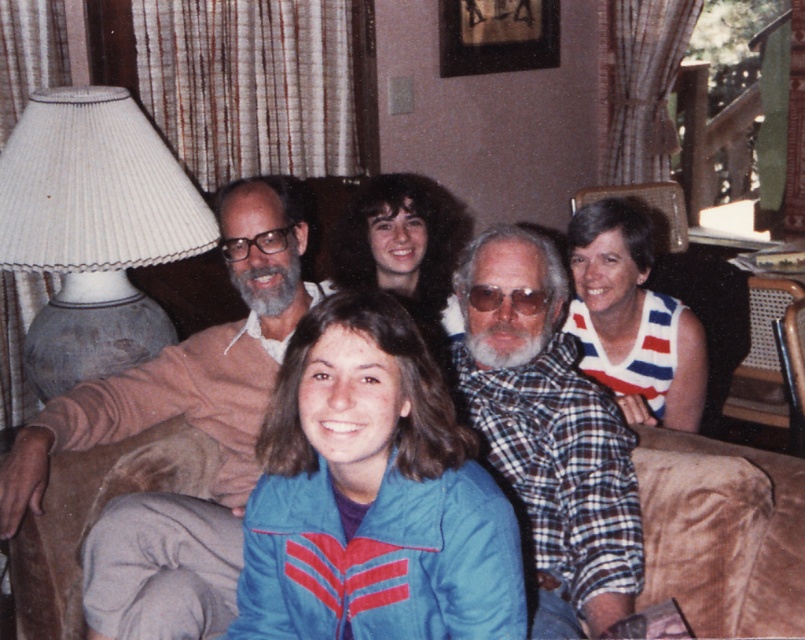
Question: Does blue nylon jacket at center have a larger size compared to matte black glasses at upper center?

Choices:
 (A) yes
 (B) no

Answer: (A)

Question: Which of the following is the farthest from the observer?

Choices:
 (A) (469, 289)
 (B) (742, 547)
 (C) (39, 499)

Answer: (C)

Question: Does light brown sweater at left come behind matte black glasses at upper center?

Choices:
 (A) yes
 (B) no

Answer: (B)

Question: Based on their relative distances, which object is nearer to the dark brown curly hair at center?

Choices:
 (A) blue nylon jacket at center
 (B) plaid flannel shirt at center
 (C) clear plastic glasses at center
 (D) light brown sweater at left

Answer: (D)

Question: Among these objects, which one is farthest from the camera?

Choices:
 (A) matte black glasses at upper center
 (B) dark brown curly hair at center
 (C) white striped sweater at upper right
 (D) white pleated lampshade at left

Answer: (C)

Question: Is white pleated lampshade at left above matte black glasses at upper center?

Choices:
 (A) no
 (B) yes

Answer: (B)